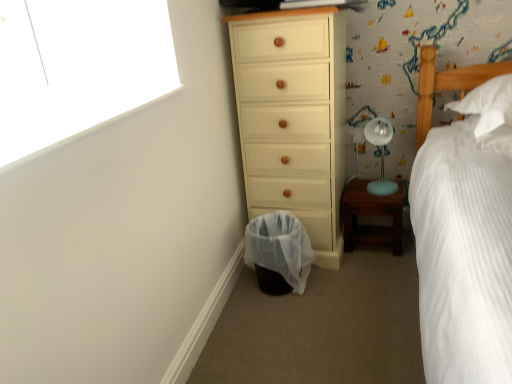
In order to click on free space above wooden nightstand at lower right (from a real-world perspective) in this screenshot , I will do pos(376,187).